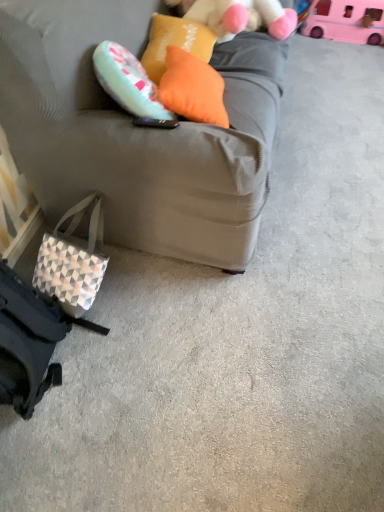
In order to face fluffy white teddy bear at upper center, should I rotate leftwards or rightwards?

You should look right and rotate roughly 6.860 degrees.

Measure the distance between point (218, 18) and camera.

Point (218, 18) and camera are 5.94 feet apart from each other.

Measure the distance between point (51, 275) and camera.

1.48 meters.

What do you see at coordinates (192, 88) in the screenshot?
I see `orange fabric pillow at upper center, which is counted as the 1th pillow, starting from the front` at bounding box center [192, 88].

In order to face orange fabric pillow at upper center, which is the 2th pillow from front to back, should I rotate leftwards or rightwards?

To align with it, rotate left about 2.190°.

This screenshot has width=384, height=512. Describe the element at coordinates (138, 132) in the screenshot. I see `matte gray couch at center` at that location.

You are a GUI agent. You are given a task and a screenshot of the screen. Output one action in this format:
    pyautogui.click(x=<x>, y=<y>)
    Task: Click on the pink plastic toy at upper right
    The height and width of the screenshot is (512, 384).
    Given the screenshot: What is the action you would take?
    pyautogui.click(x=346, y=21)

From the image's perspective, between fluffy white teddy bear at upper center and matte gray couch at center, which one is located above?

fluffy white teddy bear at upper center is shown above in the image.

Considering the relative sizes of fluffy white teddy bear at upper center and matte gray couch at center in the image provided, is fluffy white teddy bear at upper center bigger than matte gray couch at center?

Incorrect, fluffy white teddy bear at upper center is not larger than matte gray couch at center.

Can you confirm if fluffy white teddy bear at upper center is shorter than matte gray couch at center?

Indeed, fluffy white teddy bear at upper center has a lesser height compared to matte gray couch at center.

From a real-world perspective, is fluffy white teddy bear at upper center below matte gray couch at center?

Actually, fluffy white teddy bear at upper center is physically above matte gray couch at center in the real world.

Considering the sizes of pink plastic toy at upper right and geometric-patterned fabric pouch at lower left in the image, is pink plastic toy at upper right wider or thinner than geometric-patterned fabric pouch at lower left?

Clearly, pink plastic toy at upper right has less width compared to geometric-patterned fabric pouch at lower left.

Is the position of pink plastic toy at upper right less distant than that of geometric-patterned fabric pouch at lower left?

No, it is behind geometric-patterned fabric pouch at lower left.

Is pink plastic toy at upper right oriented towards geometric-patterned fabric pouch at lower left?

Yes, pink plastic toy at upper right is turned towards geometric-patterned fabric pouch at lower left.

How much distance is there between pink plastic toy at upper right and geometric-patterned fabric pouch at lower left?

A distance of 2.49 meters exists between pink plastic toy at upper right and geometric-patterned fabric pouch at lower left.

Would you say orange fabric pillow at upper center, which is counted as the 1th pillow, starting from the front, is inside or outside matte gray couch at center?

orange fabric pillow at upper center, which is counted as the 1th pillow, starting from the front, fits inside matte gray couch at center.

Is orange fabric pillow at upper center, which is counted as the 1th pillow, starting from the front, looking in the opposite direction of matte gray couch at center?

Absolutely, orange fabric pillow at upper center, which is counted as the 1th pillow, starting from the front, is directed away from matte gray couch at center.

Which of these two, orange fabric pillow at upper center, which is counted as the 1th pillow, starting from the front, or matte gray couch at center, stands taller?

matte gray couch at center is taller.

Does geometric-patterned fabric pouch at lower left come in front of matte gray couch at center?

No, the depth of geometric-patterned fabric pouch at lower left is greater than that of matte gray couch at center.

I want to click on pouch below the matte gray couch at center (from the image's perspective), so click(x=73, y=260).

How different are the orientations of geometric-patterned fabric pouch at lower left and matte gray couch at center in degrees?

The angular difference between geometric-patterned fabric pouch at lower left and matte gray couch at center is 1.12 degrees.

Consider the image. Considering the sizes of objects geometric-patterned fabric pouch at lower left and matte gray couch at center in the image provided, who is smaller, geometric-patterned fabric pouch at lower left or matte gray couch at center?

With smaller size is geometric-patterned fabric pouch at lower left.

How different are the orientations of matte gray couch at center and orange fabric pillow at upper center, placed as the second pillow when sorted from back to front, in degrees?

8.92 degrees separate the facing orientations of matte gray couch at center and orange fabric pillow at upper center, placed as the second pillow when sorted from back to front.

Which is more to the left, matte gray couch at center or orange fabric pillow at upper center, which is counted as the 1th pillow, starting from the front?

From the viewer's perspective, matte gray couch at center appears more on the left side.

From the image's perspective, which pillow is the 2nd one below the matte gray couch at center? Please provide its 2D coordinates.

[(192, 88)]

Are matte gray couch at center and orange fabric pillow at upper center, which is counted as the 1th pillow, starting from the front, located far from each other?

Actually, matte gray couch at center and orange fabric pillow at upper center, which is counted as the 1th pillow, starting from the front, are a little close together.

Starting from the geometric-patterned fabric pouch at lower left, which pillow is the 2nd one behind? Please provide its 2D coordinates.

[(175, 42)]

From a real-world perspective, is geometric-patterned fabric pouch at lower left below orange fabric pillow at upper center, the first pillow viewed from the back?

Indeed, from a real-world perspective, geometric-patterned fabric pouch at lower left is positioned beneath orange fabric pillow at upper center, the first pillow viewed from the back.

Is geometric-patterned fabric pouch at lower left wider or thinner than orange fabric pillow at upper center, the first pillow viewed from the back?

geometric-patterned fabric pouch at lower left is wider than orange fabric pillow at upper center, the first pillow viewed from the back.

From the image's perspective, is geometric-patterned fabric pouch at lower left located above or below orange fabric pillow at upper center, which is the 2th pillow from front to back?

geometric-patterned fabric pouch at lower left is below orange fabric pillow at upper center, which is the 2th pillow from front to back.

Is there a large distance between orange fabric pillow at upper center, placed as the second pillow when sorted from back to front, and pink plastic toy at upper right?

Yes, orange fabric pillow at upper center, placed as the second pillow when sorted from back to front, and pink plastic toy at upper right are quite far apart.

From the image's perspective, is orange fabric pillow at upper center, which is counted as the 1th pillow, starting from the front, above pink plastic toy at upper right?

No, from the image's perspective, orange fabric pillow at upper center, which is counted as the 1th pillow, starting from the front, is not over pink plastic toy at upper right.

Is orange fabric pillow at upper center, which is counted as the 1th pillow, starting from the front, wider than pink plastic toy at upper right?

No.

Is orange fabric pillow at upper center, which is counted as the 1th pillow, starting from the front, facing away from pink plastic toy at upper right?

No, pink plastic toy at upper right is not at the back of orange fabric pillow at upper center, which is counted as the 1th pillow, starting from the front.

In order to click on studio couch lying in front of the fluffy white teddy bear at upper center in this screenshot , I will do `click(138, 132)`.

I want to click on pouch on the left of pink plastic toy at upper right, so click(73, 260).

Considering their positions, is geometric-patterned fabric pouch at lower left positioned closer to fluffy white teddy bear at upper center than orange fabric pillow at upper center, the first pillow viewed from the back?

orange fabric pillow at upper center, the first pillow viewed from the back, is positioned closer to the anchor fluffy white teddy bear at upper center.

Estimate the real-world distances between objects in this image. Which object is further from matte gray couch at center, orange fabric pillow at upper center, which is the 2th pillow from front to back, or geometric-patterned fabric pouch at lower left?

Based on the image, geometric-patterned fabric pouch at lower left appears to be further to matte gray couch at center.

From the image, which object appears to be farther from geometric-patterned fabric pouch at lower left, orange fabric pillow at upper center, which is counted as the 1th pillow, starting from the front, or orange fabric pillow at upper center, which is the 2th pillow from front to back?

orange fabric pillow at upper center, which is the 2th pillow from front to back, is further to geometric-patterned fabric pouch at lower left.

Considering their positions, is fluffy white teddy bear at upper center positioned closer to geometric-patterned fabric pouch at lower left than orange fabric pillow at upper center, the first pillow viewed from the back?

The object closer to geometric-patterned fabric pouch at lower left is orange fabric pillow at upper center, the first pillow viewed from the back.

From the image, which object appears to be nearer to pink plastic toy at upper right, orange fabric pillow at upper center, the first pillow viewed from the back, or orange fabric pillow at upper center, which is counted as the 1th pillow, starting from the front?

Based on the image, orange fabric pillow at upper center, the first pillow viewed from the back, appears to be nearer to pink plastic toy at upper right.

Which object lies nearer to the anchor point pink plastic toy at upper right, orange fabric pillow at upper center, the first pillow viewed from the back, or matte gray couch at center?

orange fabric pillow at upper center, the first pillow viewed from the back, lies closer to pink plastic toy at upper right than the other object.

Estimate the real-world distances between objects in this image. Which object is further from matte gray couch at center, fluffy white teddy bear at upper center or orange fabric pillow at upper center, which is the 2th pillow from front to back?

The object further to matte gray couch at center is fluffy white teddy bear at upper center.

Considering their positions, is geometric-patterned fabric pouch at lower left positioned further to matte gray couch at center than orange fabric pillow at upper center, which is the 2th pillow from front to back?

geometric-patterned fabric pouch at lower left is further to matte gray couch at center.

Find the location of a particular element. The width and height of the screenshot is (384, 512). pillow that lies between orange fabric pillow at upper center, the first pillow viewed from the back, and geometric-patterned fabric pouch at lower left from top to bottom is located at coordinates (192, 88).

Find the location of a particular element. teddy between pink plastic toy at upper right and geometric-patterned fabric pouch at lower left in the vertical direction is located at coordinates (239, 16).

This screenshot has height=512, width=384. I want to click on pillow between orange fabric pillow at upper center, placed as the second pillow when sorted from back to front, and pink plastic toy at upper right from front to back, so click(175, 42).

The height and width of the screenshot is (512, 384). Find the location of `studio couch that lies between fluffy white teddy bear at upper center and geometric-patterned fabric pouch at lower left from top to bottom`. studio couch that lies between fluffy white teddy bear at upper center and geometric-patterned fabric pouch at lower left from top to bottom is located at coordinates (138, 132).